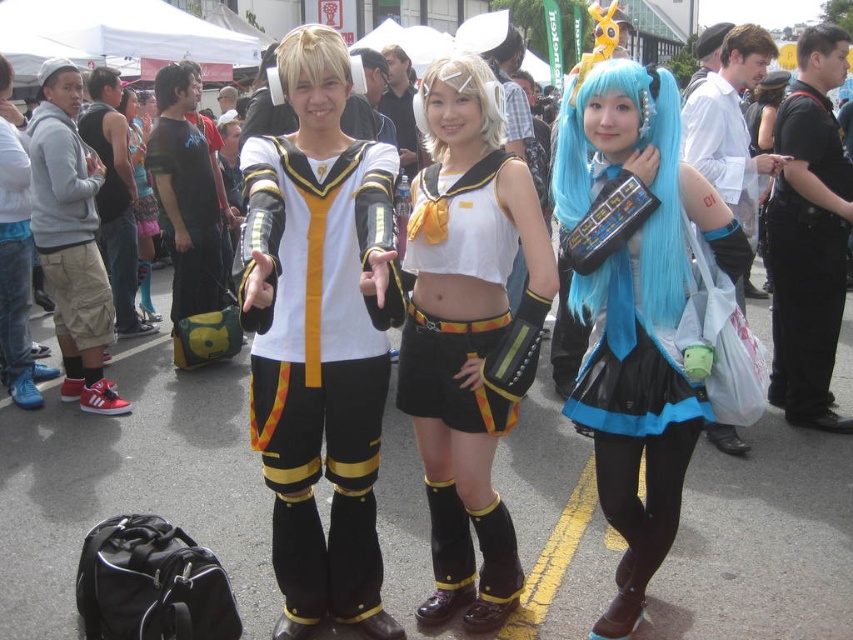
Question: Does white matte uniform at center have a greater width compared to black fabric bag at center?

Choices:
 (A) yes
 (B) no

Answer: (A)

Question: Can you confirm if black leather jacket at upper right is positioned below matte black skirt at center?

Choices:
 (A) no
 (B) yes

Answer: (B)

Question: Which object is positioned farthest from the shiny blue wig at center?

Choices:
 (A) matte black and yellow armor at center
 (B) blue satin dress at center
 (C) white matte uniform at center

Answer: (A)

Question: Is white matte uniform at center above blue satin dress at center?

Choices:
 (A) yes
 (B) no

Answer: (B)

Question: Which point is farther to the camera?

Choices:
 (A) (136, 120)
 (B) (659, 264)
 (C) (438, 128)
 (D) (196, 257)

Answer: (A)

Question: Considering the real-world distances, which object is closest to the blue satin dress at center?

Choices:
 (A) black leather jacket at upper right
 (B) black fabric bag at center

Answer: (A)